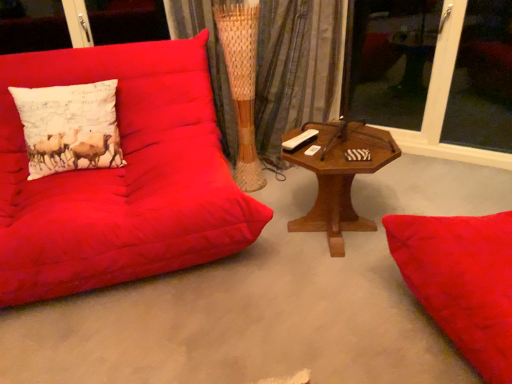
This screenshot has height=384, width=512. What are the coordinates of `transparent glass window at upper right, the 2th window screen from the left` in the screenshot? It's located at (482, 80).

Image resolution: width=512 pixels, height=384 pixels. Find the location of `woodenobject at center`. woodenobject at center is located at coordinates (339, 176).

Describe the element at coordinates (121, 177) in the screenshot. I see `matte red couch at left` at that location.

Locate an element on the screen. This screenshot has height=384, width=512. matte red couch at left is located at coordinates (121, 177).

Measure the distance between point [72,128] and camera.

6.39 feet.

Describe the element at coordinates (390, 63) in the screenshot. The width and height of the screenshot is (512, 384). I see `transparent glass window at upper right, the 1th window screen when ordered from left to right` at that location.

At what (x,y) coordinates should I click in order to perform the action: click on transparent glass window at upper right, which ranks as the 1th window screen in right-to-left order. Please return your answer as a coordinate pair (x, y). The width and height of the screenshot is (512, 384). Looking at the image, I should click on tap(482, 80).

How much distance is there between transparent glass window at upper right, which ranks as the 1th window screen in right-to-left order, and transparent glass window at upper right, the 1th window screen when ordered from left to right?

transparent glass window at upper right, which ranks as the 1th window screen in right-to-left order, is 23.22 inches from transparent glass window at upper right, the 1th window screen when ordered from left to right.

Between point (464, 27) and point (396, 98), which one is positioned behind?

The point (396, 98) is farther.

Which is behind, transparent glass window at upper right, which ranks as the 1th window screen in right-to-left order, or transparent glass window at upper right, the 1th window screen when ordered from left to right?

transparent glass window at upper right, the 1th window screen when ordered from left to right, is behind.

From a real-world perspective, who is located lower, transparent glass window at upper right, the 2th window screen from the left, or transparent glass window at upper right, the 1th window screen when ordered from left to right?

transparent glass window at upper right, the 1th window screen when ordered from left to right, from a real-world perspective.

From the image's perspective, is transparent glass window at upper right, marked as the 2th window screen in a right-to-left arrangement, located beneath transparent glass window at upper right, which ranks as the 1th window screen in right-to-left order?

Actually, transparent glass window at upper right, marked as the 2th window screen in a right-to-left arrangement, appears above transparent glass window at upper right, which ranks as the 1th window screen in right-to-left order, in the image.

Locate an element on the screen. The width and height of the screenshot is (512, 384). window screen located below the transparent glass window at upper right, marked as the 2th window screen in a right-to-left arrangement (from the image's perspective) is located at coordinates click(x=482, y=80).

Is transparent glass window at upper right, marked as the 2th window screen in a right-to-left arrangement, in front of transparent glass window at upper right, the 2th window screen from the left?

No, it is not.

How different are the orientations of white printed cushion at left and transparent glass window at upper right, the 2th window screen from the left, in degrees?

The facing directions of white printed cushion at left and transparent glass window at upper right, the 2th window screen from the left, are 50.4 degrees apart.

Based on the photo, is white printed cushion at left smaller than transparent glass window at upper right, which ranks as the 1th window screen in right-to-left order?

Correct, white printed cushion at left occupies less space than transparent glass window at upper right, which ranks as the 1th window screen in right-to-left order.

Considering the relative sizes of white printed cushion at left and transparent glass window at upper right, which ranks as the 1th window screen in right-to-left order, in the image provided, is white printed cushion at left wider than transparent glass window at upper right, which ranks as the 1th window screen in right-to-left order,?

Indeed, white printed cushion at left has a greater width compared to transparent glass window at upper right, which ranks as the 1th window screen in right-to-left order.

Considering the sizes of objects white printed cushion at left and transparent glass window at upper right, the 2th window screen from the left, in the image provided, who is shorter, white printed cushion at left or transparent glass window at upper right, the 2th window screen from the left,?

white printed cushion at left is shorter.

Identify the location of pillow below the transparent glass window at upper right, marked as the 2th window screen in a right-to-left arrangement (from the image's perspective). (69, 127).

Based on the photo, is transparent glass window at upper right, marked as the 2th window screen in a right-to-left arrangement, facing towards white printed cushion at left?

No, transparent glass window at upper right, marked as the 2th window screen in a right-to-left arrangement, is not oriented towards white printed cushion at left.

Considering the sizes of objects transparent glass window at upper right, marked as the 2th window screen in a right-to-left arrangement, and white printed cushion at left in the image provided, who is smaller, transparent glass window at upper right, marked as the 2th window screen in a right-to-left arrangement, or white printed cushion at left?

white printed cushion at left is smaller.

Is transparent glass window at upper right, marked as the 2th window screen in a right-to-left arrangement, in contact with white printed cushion at left?

No, transparent glass window at upper right, marked as the 2th window screen in a right-to-left arrangement, is not in contact with white printed cushion at left.

Is matte red couch at left next to transparent glass window at upper right, the 1th window screen when ordered from left to right, and touching it?

matte red couch at left is not next to transparent glass window at upper right, the 1th window screen when ordered from left to right, and they're not touching.

Between point (200, 253) and point (359, 29), which one is positioned behind?

Positioned behind is point (359, 29).

Which object is positioned more to the right, matte red couch at left or transparent glass window at upper right, marked as the 2th window screen in a right-to-left arrangement?

transparent glass window at upper right, marked as the 2th window screen in a right-to-left arrangement.

From the picture: Does matte red couch at left have a lesser height compared to transparent glass window at upper right, marked as the 2th window screen in a right-to-left arrangement?

Yes, matte red couch at left is shorter than transparent glass window at upper right, marked as the 2th window screen in a right-to-left arrangement.

Could you tell me if woodenobject at center is facing matte red couch at left?

No, woodenobject at center is not turned towards matte red couch at left.

From the image's perspective, is woodenobject at center over matte red couch at left?

Actually, woodenobject at center appears below matte red couch at left in the image.

From a real-world perspective, does woodenobject at center sit lower than matte red couch at left?

Correct, in the physical world, woodenobject at center is lower than matte red couch at left.

Can you confirm if woodenobject at center is taller than matte red couch at left?

In fact, woodenobject at center may be shorter than matte red couch at left.

Do you think woven fabric curtain at center is within matte red couch at left, or outside of it?

woven fabric curtain at center is outside matte red couch at left.

Is woven fabric curtain at center shorter than matte red couch at left?

No, woven fabric curtain at center is not shorter than matte red couch at left.

Considering the positions of points (224, 124) and (17, 196), is point (224, 124) farther from camera compared to point (17, 196)?

Yes.

Is woven fabric curtain at center at the left side of matte red couch at left?

→ Incorrect, woven fabric curtain at center is not on the left side of matte red couch at left.

Locate an element on the screen. window screen below the transparent glass window at upper right, the 2th window screen from the left (from a real-world perspective) is located at coordinates (390, 63).

Identify the location of window screen lying on the left of transparent glass window at upper right, the 2th window screen from the left. This screenshot has height=384, width=512. (390, 63).

When comparing their distances from transparent glass window at upper right, the 2th window screen from the left, does matte red couch at left or woodenobject at center seem closer?

woodenobject at center is closer to transparent glass window at upper right, the 2th window screen from the left.

When comparing their distances from transparent glass window at upper right, marked as the 2th window screen in a right-to-left arrangement, does transparent glass window at upper right, which ranks as the 1th window screen in right-to-left order, or white printed cushion at left seem closer?

The object closer to transparent glass window at upper right, marked as the 2th window screen in a right-to-left arrangement, is transparent glass window at upper right, which ranks as the 1th window screen in right-to-left order.

Which object lies further to the anchor point matte red couch at left, transparent glass window at upper right, the 2th window screen from the left, or woodenobject at center?

transparent glass window at upper right, the 2th window screen from the left, is positioned further to the anchor matte red couch at left.

Looking at the image, which one is located further to woven fabric curtain at center, woodenobject at center or transparent glass window at upper right, which ranks as the 1th window screen in right-to-left order?

Among the two, transparent glass window at upper right, which ranks as the 1th window screen in right-to-left order, is located further to woven fabric curtain at center.

From the image, which object appears to be farther from transparent glass window at upper right, which ranks as the 1th window screen in right-to-left order, transparent glass window at upper right, the 1th window screen when ordered from left to right, or matte red couch at left?

matte red couch at left.

In the scene shown: From the image, which object appears to be nearer to white printed cushion at left, transparent glass window at upper right, the 1th window screen when ordered from left to right, or woodenobject at center?

Based on the image, woodenobject at center appears to be nearer to white printed cushion at left.

Based on their spatial positions, is woven fabric curtain at center or transparent glass window at upper right, the 2th window screen from the left, closer to woodenobject at center?

woven fabric curtain at center is positioned closer to the anchor woodenobject at center.

Based on their spatial positions, is woven fabric curtain at center or woodenobject at center further from transparent glass window at upper right, the 1th window screen when ordered from left to right?

The object further to transparent glass window at upper right, the 1th window screen when ordered from left to right, is woodenobject at center.

Image resolution: width=512 pixels, height=384 pixels. I want to click on table between matte red couch at left and transparent glass window at upper right, the 1th window screen when ordered from left to right, so click(x=339, y=176).

Locate an element on the screen. window screen located between woodenobject at center and transparent glass window at upper right, the 2th window screen from the left, in the left-right direction is located at coordinates (390, 63).

I want to click on curtain between matte red couch at left and woodenobject at center from left to right, so click(296, 68).

You are a GUI agent. You are given a task and a screenshot of the screen. Output one action in this format:
    pyautogui.click(x=<x>, y=<y>)
    Task: Click on the studio couch between white printed cushion at left and woven fabric curtain at center in the horizontal direction
    
    Given the screenshot: What is the action you would take?
    pyautogui.click(x=121, y=177)